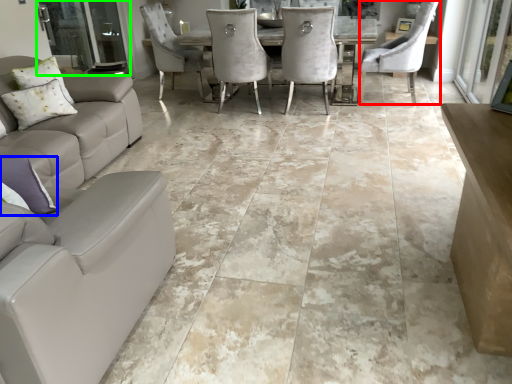
Question: Which is farther away from chair (highlighted by a red box)? pillow (highlighted by a blue box) or screen door (highlighted by a green box)?

Choices:
 (A) pillow
 (B) screen door

Answer: (A)